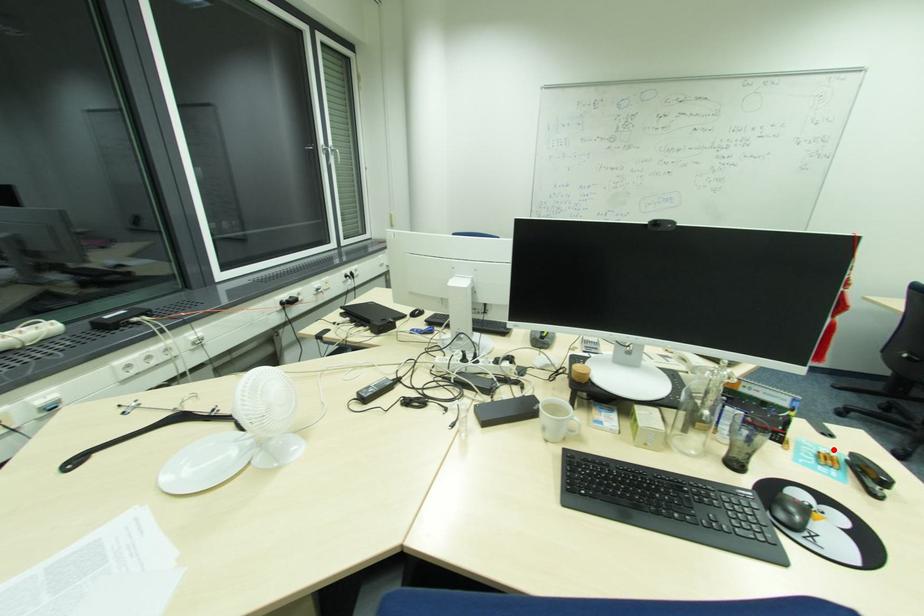
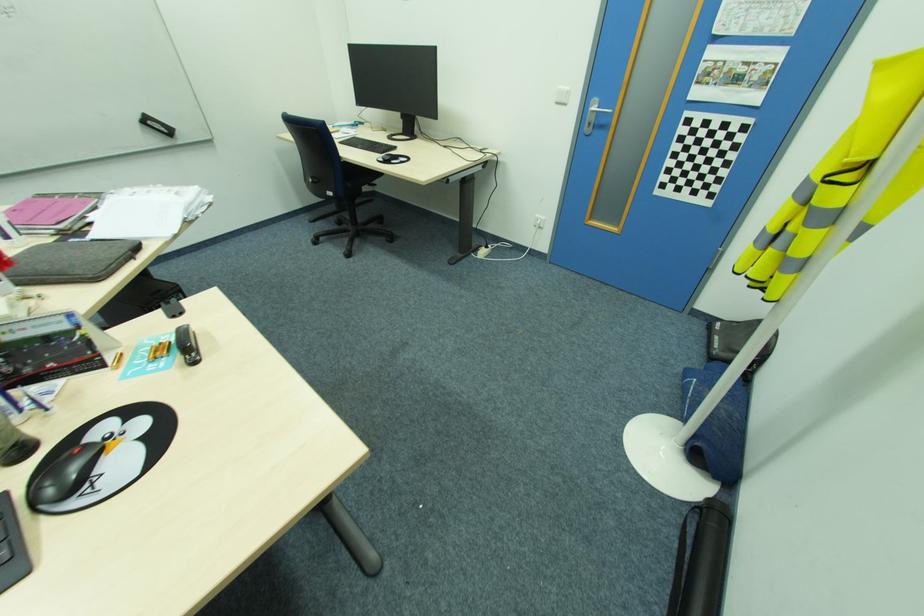
The point at the highlighted location is marked in the first image. Where is the corresponding point in the second image?

(174, 334)